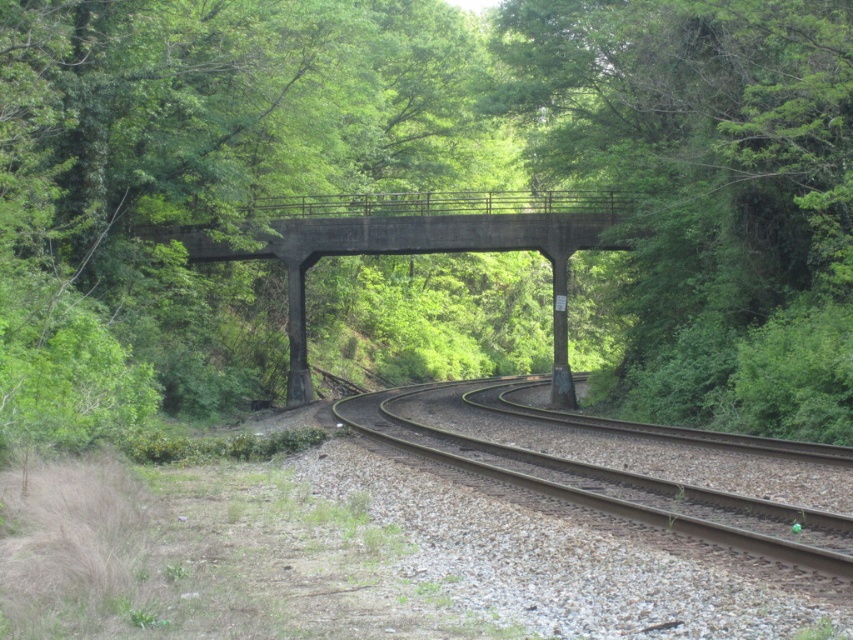
Which is below, concrete bridge at center or metal/smooth track at center?

metal/smooth track at center

Does point (332, 205) come closer to viewer compared to point (817, 525)?

No.

Where is `concrete bridge at center`? This screenshot has width=853, height=640. concrete bridge at center is located at coordinates (419, 244).

The width and height of the screenshot is (853, 640). Identify the location of concrete bridge at center. (419, 244).

Who is more forward, (x=685, y=404) or (x=822, y=461)?

Point (x=822, y=461) is in front.

Does green leafy tree at center come behind brown gravel track at center?

That is False.

Image resolution: width=853 pixels, height=640 pixels. Identify the location of green leafy tree at center. (426, 200).

Locate an element on the screen. Image resolution: width=853 pixels, height=640 pixels. green leafy tree at center is located at coordinates (426, 200).

Can you confirm if concrete bridge at center is positioned below brown gravel track at center?

Incorrect, concrete bridge at center is not positioned below brown gravel track at center.

Does concrete bridge at center appear on the left side of brown gravel track at center?

Correct, you'll find concrete bridge at center to the left of brown gravel track at center.

Which is in front, point (292, 310) or point (497, 400)?

Point (497, 400) is in front.

What are the coordinates of `concrete bridge at center` in the screenshot? It's located at (419, 244).